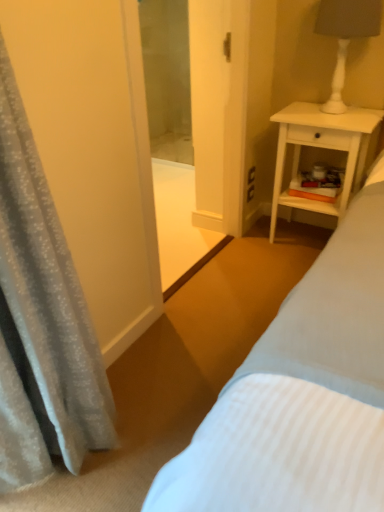
Locate an element on the screen. The image size is (384, 512). free space above white wood nightstand at right (from a real-world perspective) is located at coordinates (318, 111).